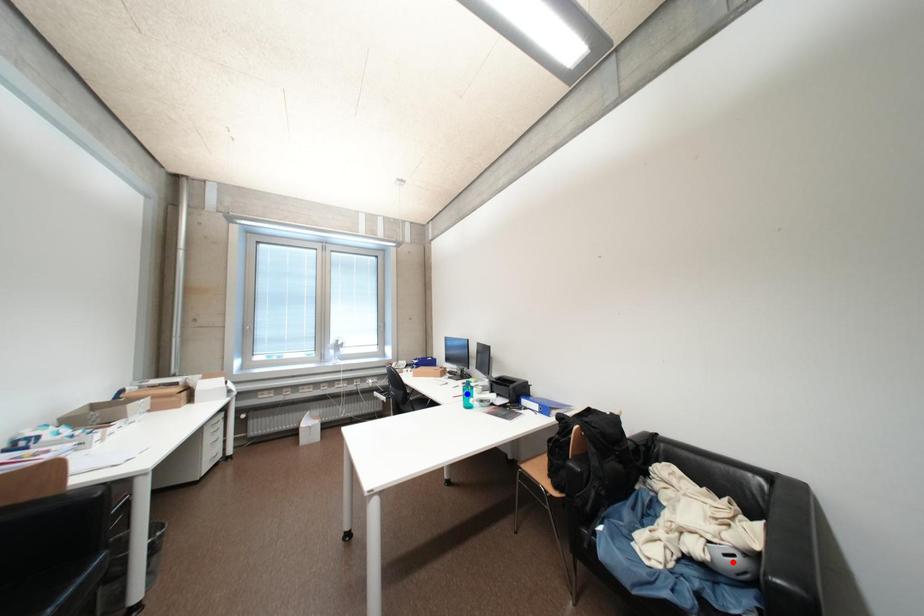
Question: Which of the two points in the image is closer to the camera?

Choices:
 (A) Blue point is closer.
 (B) Red point is closer.

Answer: (B)